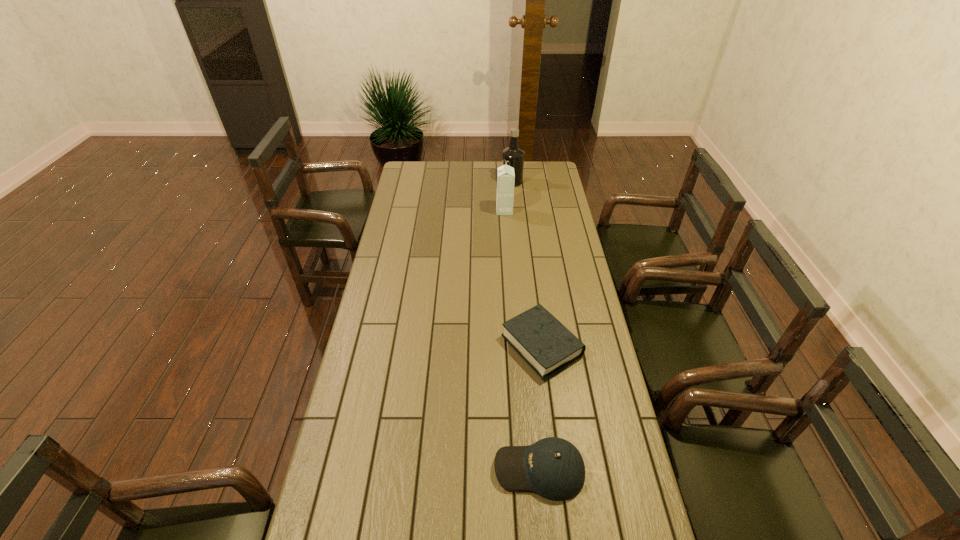
Locate an element on the screen. This screenshot has width=960, height=540. Bible at the right edge is located at coordinates (537, 336).

In the image, there is a desktop. Where is `vacant space at the far edge`? vacant space at the far edge is located at coordinates pos(530,182).

At what (x,y) coordinates should I click in order to perform the action: click on free region at the left edge. Please return your answer as a coordinate pair (x, y). The width and height of the screenshot is (960, 540). Looking at the image, I should click on (362, 372).

Identify the location of vacant space at the right edge. (546, 274).

In the image, there is a desktop. Where is `vacant space at the far right corner`? The image size is (960, 540). vacant space at the far right corner is located at coordinates (561, 183).

Where is `vacant area that lies between the second tallest object and the second nearest object`? vacant area that lies between the second tallest object and the second nearest object is located at coordinates (523, 278).

Image resolution: width=960 pixels, height=540 pixels. Identify the location of object that is the second closest to the Bible. (505, 174).

This screenshot has width=960, height=540. I want to click on object that is the third closest to the second tallest object, so click(552, 467).

This screenshot has width=960, height=540. Identify the location of vacant space that satisfies the following two spatial constraints: 1. on the front label of the third farthest object; 2. on the left side of the tallest object. (529, 346).

Locate an element on the screen. blank space that satisfies the following two spatial constraints: 1. on the front label of the shortest object; 2. on the right side of the farthest object is located at coordinates (529, 346).